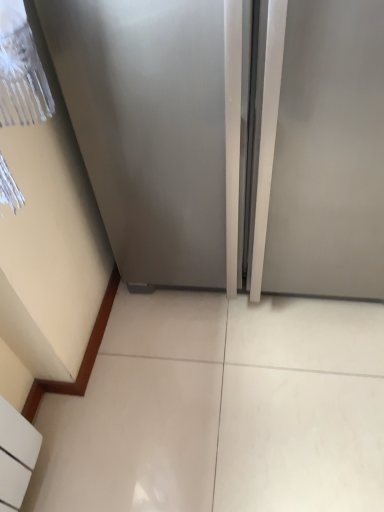
The image size is (384, 512). What do you see at coordinates (158, 128) in the screenshot?
I see `stainless steel refrigerator at center` at bounding box center [158, 128].

At what (x,y) coordinates should I click in order to perform the action: click on stainless steel refrigerator at center. Please return your answer as a coordinate pair (x, y). This screenshot has height=512, width=384. Looking at the image, I should click on (158, 128).

What are the coordinates of `stainless steel refrigerator at center` in the screenshot? It's located at (158, 128).